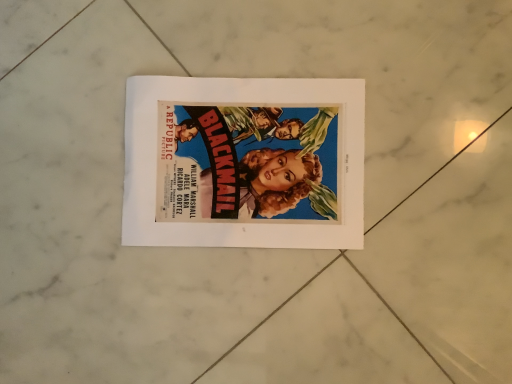
Find the location of a particular element. Image resolution: width=512 pixels, height=384 pixels. vacant space situated above matte paper poster at center (from a real-world perspective) is located at coordinates (241, 163).